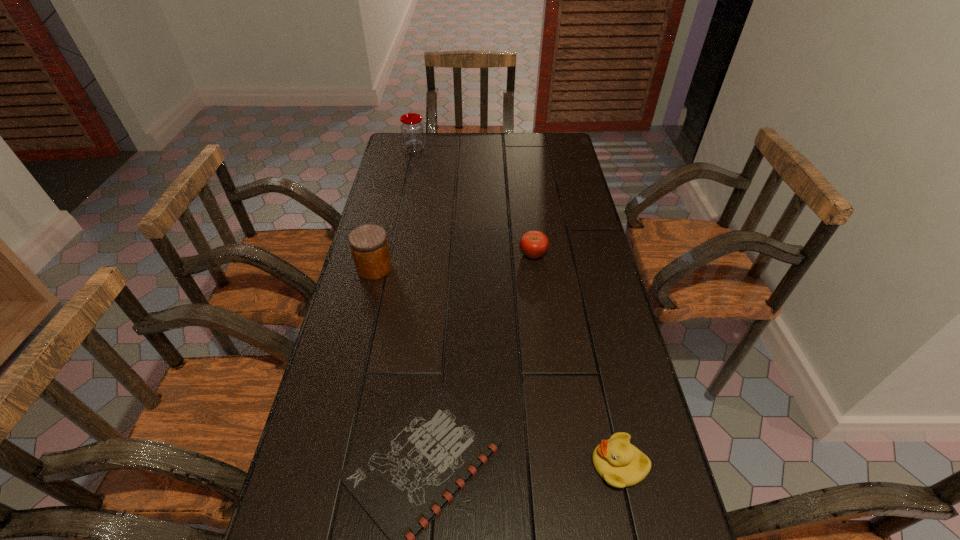
I want to click on the farther jar, so click(x=412, y=128).

You are a GUI agent. You are given a task and a screenshot of the screen. Output one action in this format:
    pyautogui.click(x=<x>, y=<y>)
    Task: Click on the nearer jar
    
    Given the screenshot: What is the action you would take?
    pyautogui.click(x=369, y=246)

This screenshot has height=540, width=960. Identify the location of the second object from right to left. (534, 244).

Where is `duckling`? duckling is located at coordinates (621, 464).

Where is `vacant region located on the front of the farther jar`? Image resolution: width=960 pixels, height=540 pixels. vacant region located on the front of the farther jar is located at coordinates (411, 164).

Image resolution: width=960 pixels, height=540 pixels. What are the coordinates of `vacant space located on the right of the nearer jar` in the screenshot? It's located at (479, 268).

This screenshot has width=960, height=540. Identify the location of vacant space located 0.100m on the right of the apple. (579, 254).

Locate an element on the screen. free space located at the face of the rightmost object is located at coordinates (517, 465).

The image size is (960, 540). In order to click on vacant area situated at the face of the rightmost object in this screenshot , I will do `click(405, 465)`.

Locate an element on the screen. The height and width of the screenshot is (540, 960). vacant area situated at the face of the rightmost object is located at coordinates (560, 465).